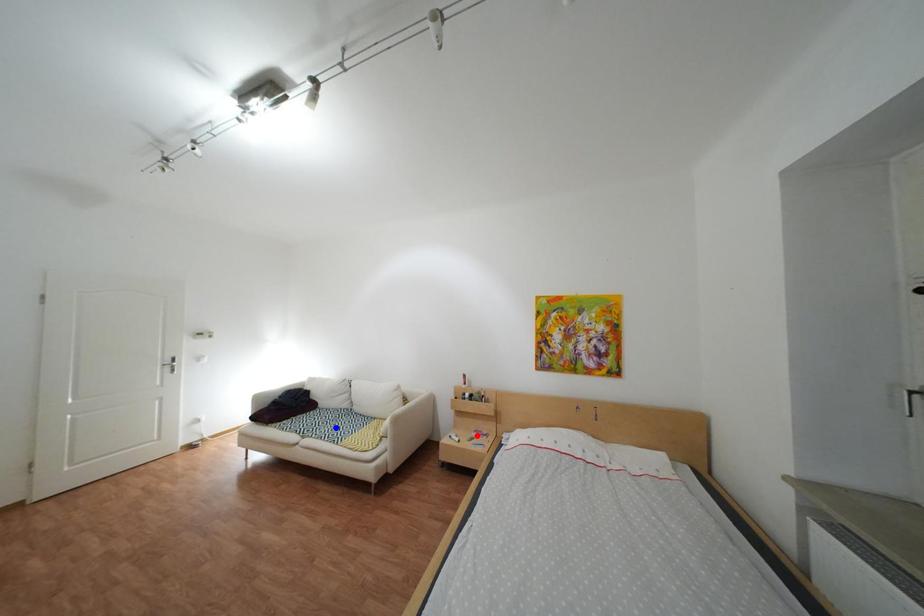
Question: Which of the two points in the image is closer to the camera?

Choices:
 (A) Blue point is closer.
 (B) Red point is closer.

Answer: (B)